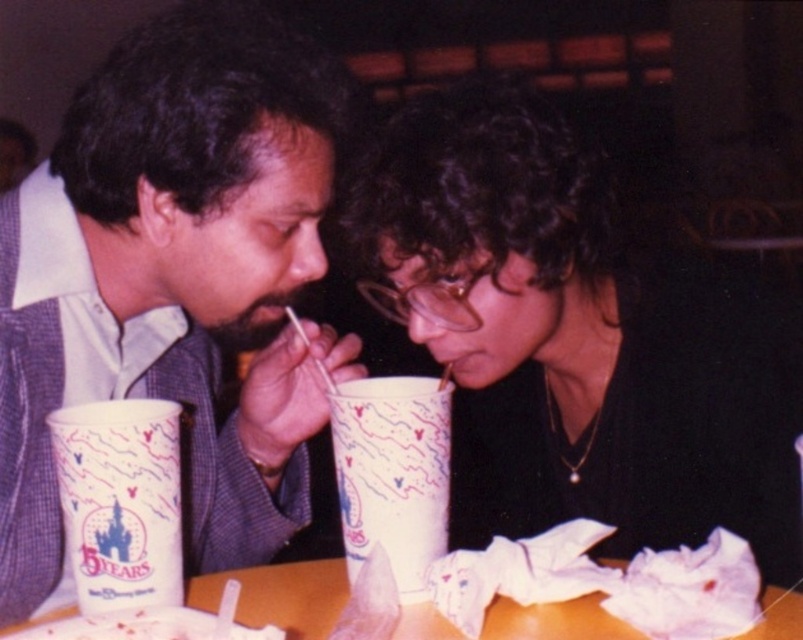
Question: Can you confirm if white paper cup at center is positioned to the left of white paper napkin at lower center?

Choices:
 (A) yes
 (B) no

Answer: (B)

Question: Which object is the closest to the matte plastic cup at left?

Choices:
 (A) white paper cup at center
 (B) white paper napkin at lower center
 (C) wooden table at center

Answer: (A)

Question: Is the position of matte plastic cup at left more distant than that of white paper cup at left?

Choices:
 (A) no
 (B) yes

Answer: (B)

Question: Is the position of matte plastic cup at left less distant than that of white paper cup at left?

Choices:
 (A) yes
 (B) no

Answer: (B)

Question: Which point appears closest to the camera in this image?

Choices:
 (A) (172, 632)
 (B) (170, 29)
 (C) (438, 621)

Answer: (A)

Question: Which of the following is the farthest from the observer?

Choices:
 (A) white paper cup at center
 (B) wooden table at center

Answer: (A)